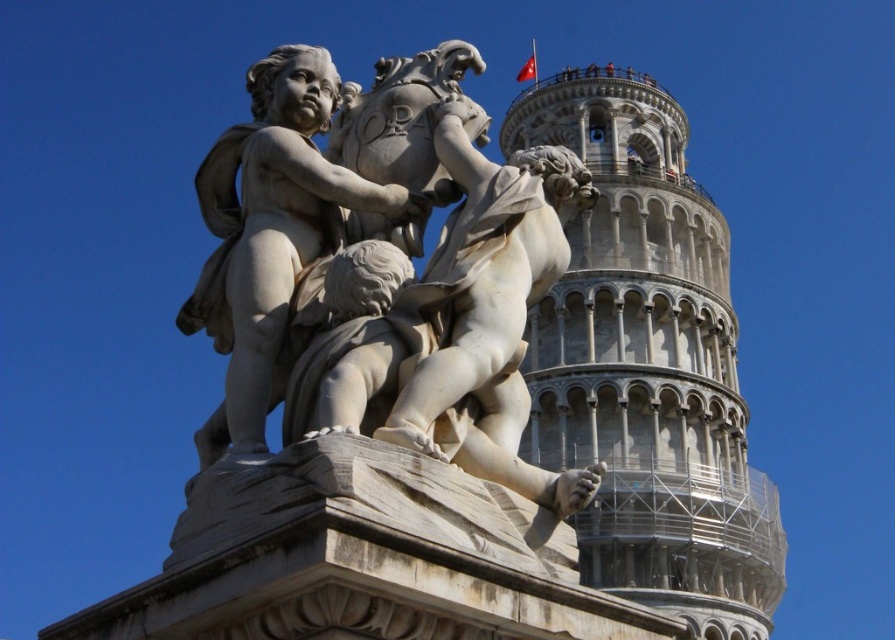
You are an art student who needs to sketch the white marble sculpture at center. The sculpture is located at coordinates point 0.426, 0.486. Do you think you can find it easily?

The white marble sculpture at center is actually located at point [380,310], so you can find it easily by checking the coordinates provided in the description.